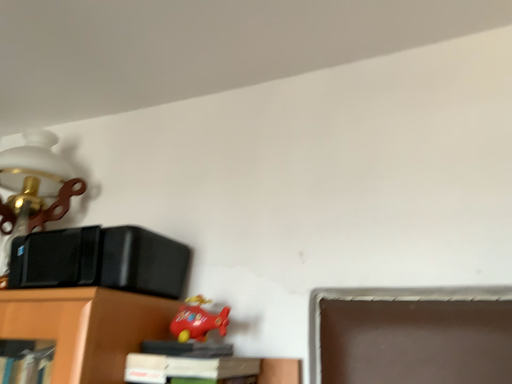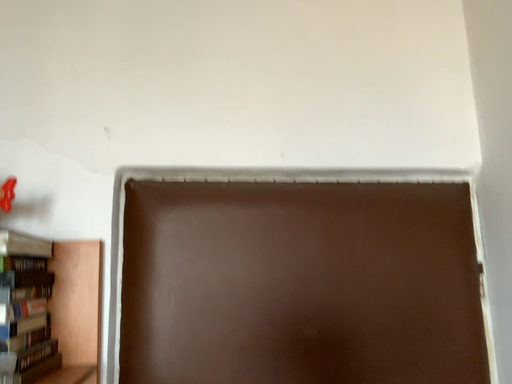
Question: How did the camera likely rotate when shooting the video?

Choices:
 (A) rotated upward
 (B) rotated downward

Answer: (B)